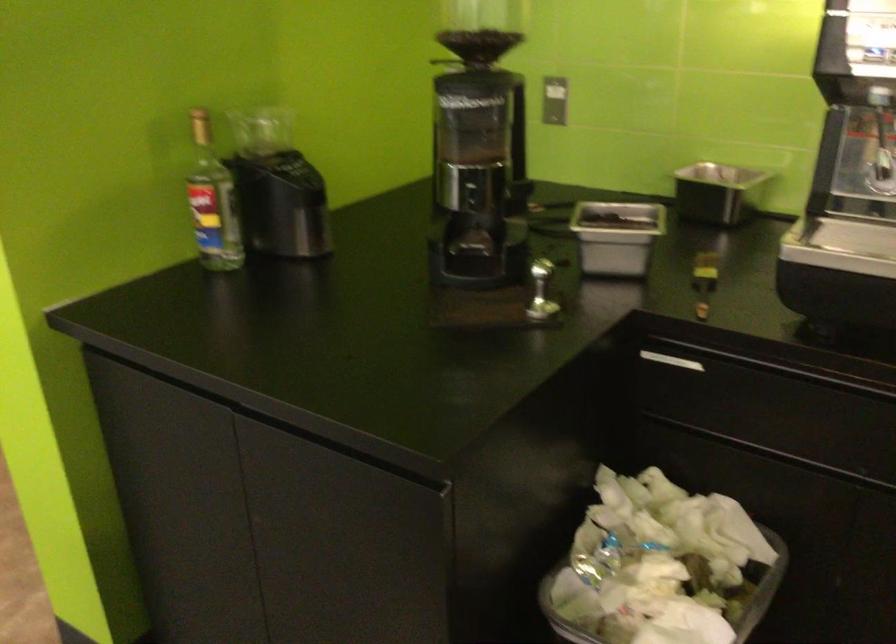
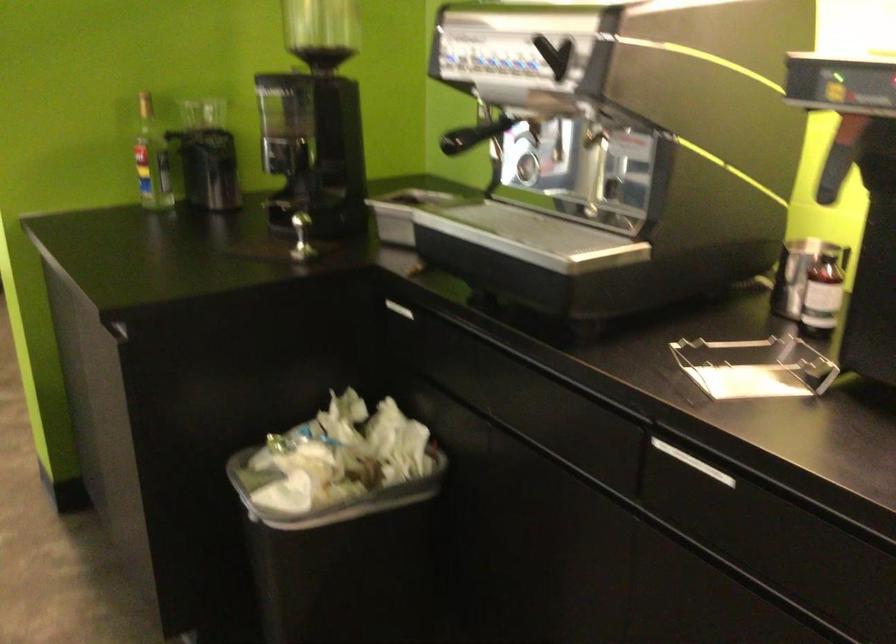
The point at (220, 204) is marked in the first image. Where is the corresponding point in the second image?

(151, 158)